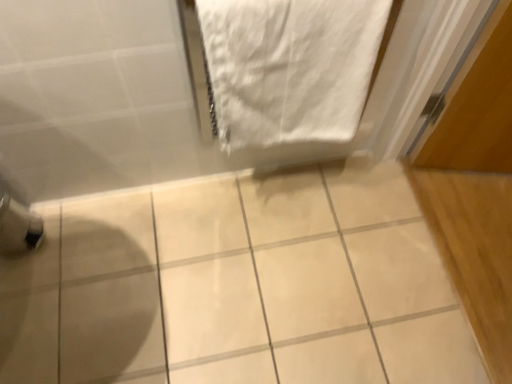
Question: Does white glossy tile at center have a lesser width compared to white cotton towel at upper right?

Choices:
 (A) no
 (B) yes

Answer: (A)

Question: From the image's perspective, is white glossy tile at center above white cotton towel at upper right?

Choices:
 (A) no
 (B) yes

Answer: (A)

Question: Can you confirm if white glossy tile at center is wider than white cotton towel at upper right?

Choices:
 (A) no
 (B) yes

Answer: (B)

Question: Is white glossy tile at center oriented towards white cotton towel at upper right?

Choices:
 (A) yes
 (B) no

Answer: (B)

Question: Is white glossy tile at center positioned far away from white cotton towel at upper right?

Choices:
 (A) no
 (B) yes

Answer: (A)

Question: Considering the relative sizes of white glossy tile at center and white cotton towel at upper right in the image provided, is white glossy tile at center bigger than white cotton towel at upper right?

Choices:
 (A) yes
 (B) no

Answer: (A)

Question: Is white cotton towel at upper right taller than white glossy tile at center?

Choices:
 (A) yes
 (B) no

Answer: (A)

Question: Can you confirm if white cotton towel at upper right is wider than white glossy tile at center?

Choices:
 (A) no
 (B) yes

Answer: (A)

Question: Does white cotton towel at upper right come behind white glossy tile at center?

Choices:
 (A) no
 (B) yes

Answer: (A)

Question: Is white cotton towel at upper right at the left side of white glossy tile at center?

Choices:
 (A) yes
 (B) no

Answer: (B)

Question: Does white cotton towel at upper right appear on the right side of white glossy tile at center?

Choices:
 (A) no
 (B) yes

Answer: (B)

Question: Is white glossy tile at center completely or partially inside white cotton towel at upper right?

Choices:
 (A) no
 (B) yes

Answer: (A)

Question: From a real-world perspective, is white glossy tile at center above or below white cotton towel at upper right?

Choices:
 (A) above
 (B) below

Answer: (B)